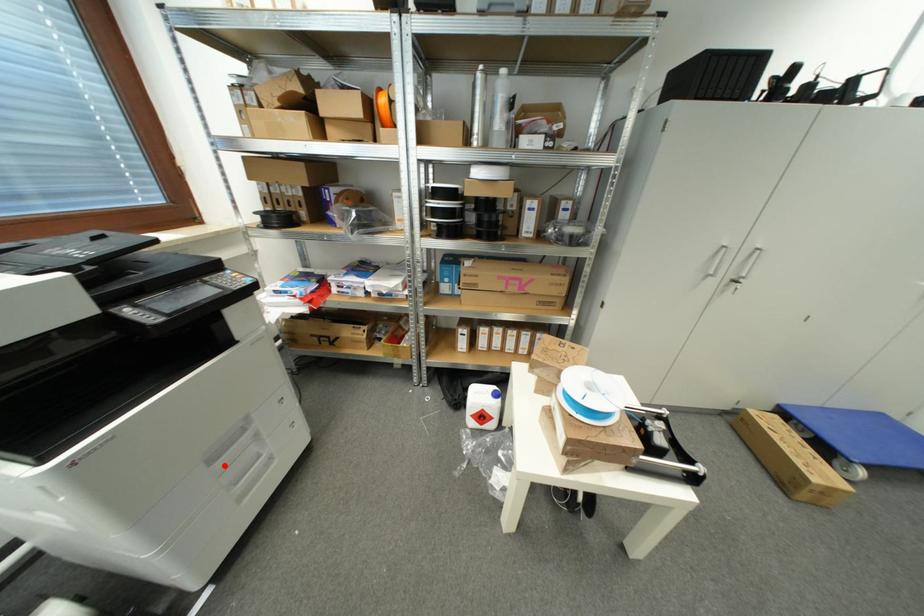
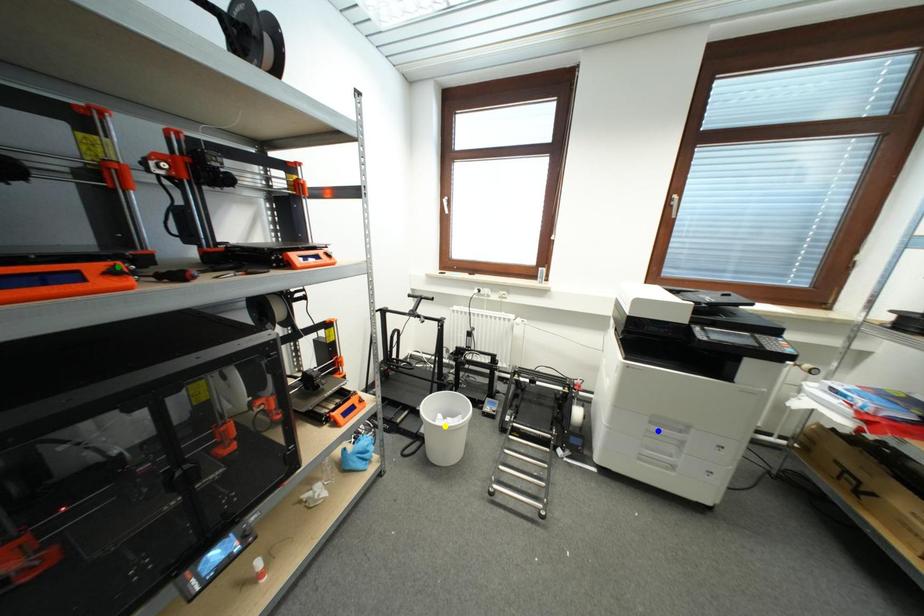
Question: I am providing you with two images of the same scene from different viewpoints. A red point is marked on the first image. You are given multiple points on the second image. Which spot in image 2 lines up with the point in image 1?

Choices:
 (A) blue point
 (B) green point
 (C) yellow point

Answer: (A)